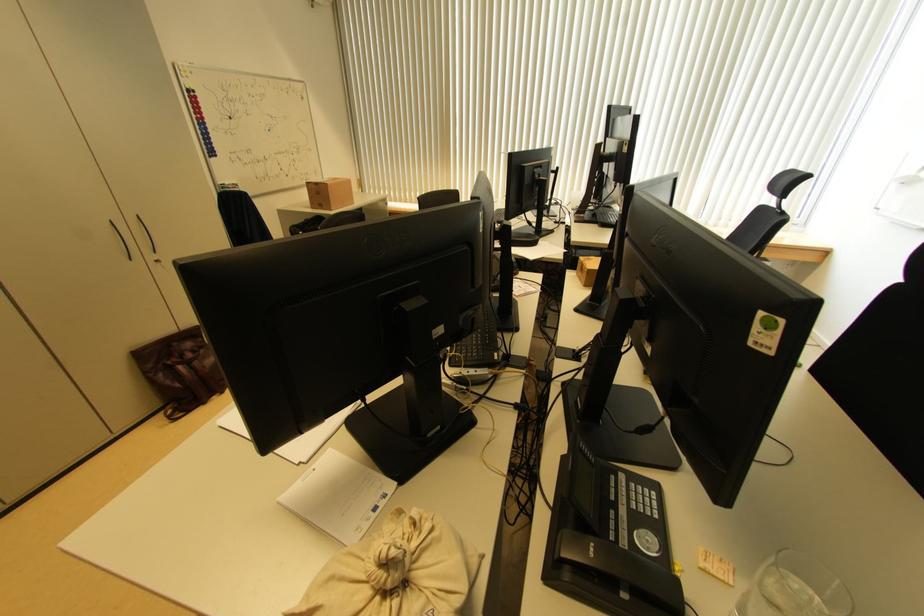
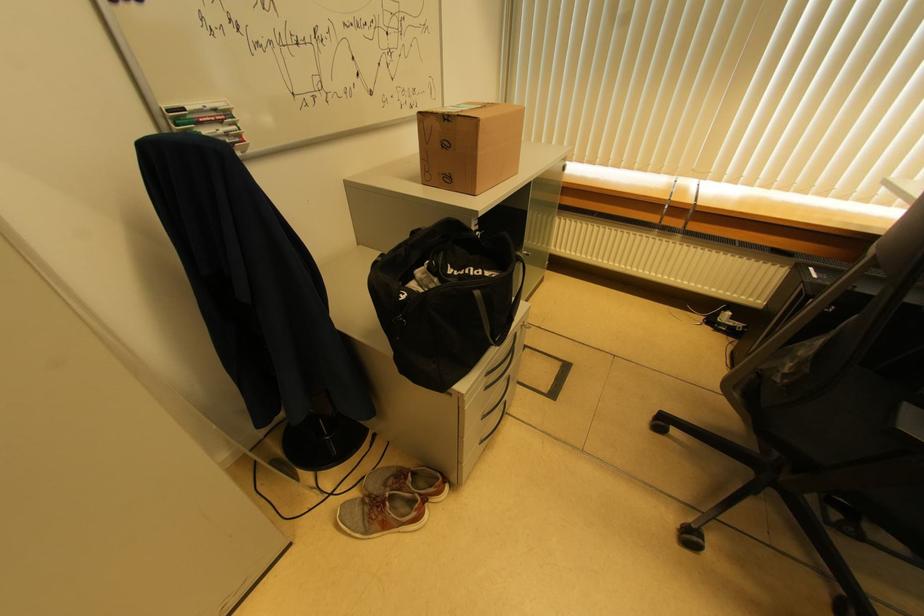
Find the pixel in the second image that matches (x=329, y=188) in the first image.

(477, 124)